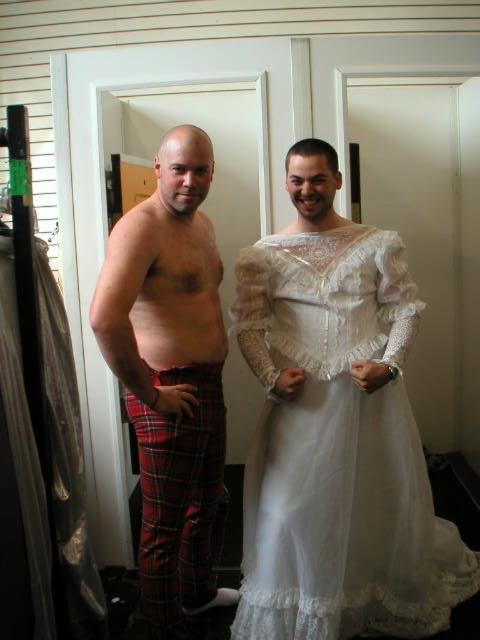
Is plaid cotton pants at left below plaid cotton kilt at lower left?

Actually, plaid cotton pants at left is above plaid cotton kilt at lower left.

Who is shorter, plaid cotton pants at left or plaid cotton kilt at lower left?

plaid cotton kilt at lower left is shorter.

Where is `plaid cotton pants at left`? The width and height of the screenshot is (480, 640). plaid cotton pants at left is located at coordinates (336, 433).

Image resolution: width=480 pixels, height=640 pixels. What do you see at coordinates (336, 433) in the screenshot?
I see `plaid cotton pants at left` at bounding box center [336, 433].

Locate an element on the screen. plaid cotton pants at left is located at coordinates (336, 433).

Between point (206, 144) and point (187, 516), which one is positioned behind?

Positioned behind is point (187, 516).

Where is `plaid cotton pants at left`? Image resolution: width=480 pixels, height=640 pixels. plaid cotton pants at left is located at coordinates (336, 433).

Which of these two, red plaid pants at left or plaid cotton kilt at lower left, stands taller?

red plaid pants at left

Locate an element on the screen. red plaid pants at left is located at coordinates (170, 376).

Locate an element on the screen. Image resolution: width=480 pixels, height=640 pixels. red plaid pants at left is located at coordinates (170, 376).